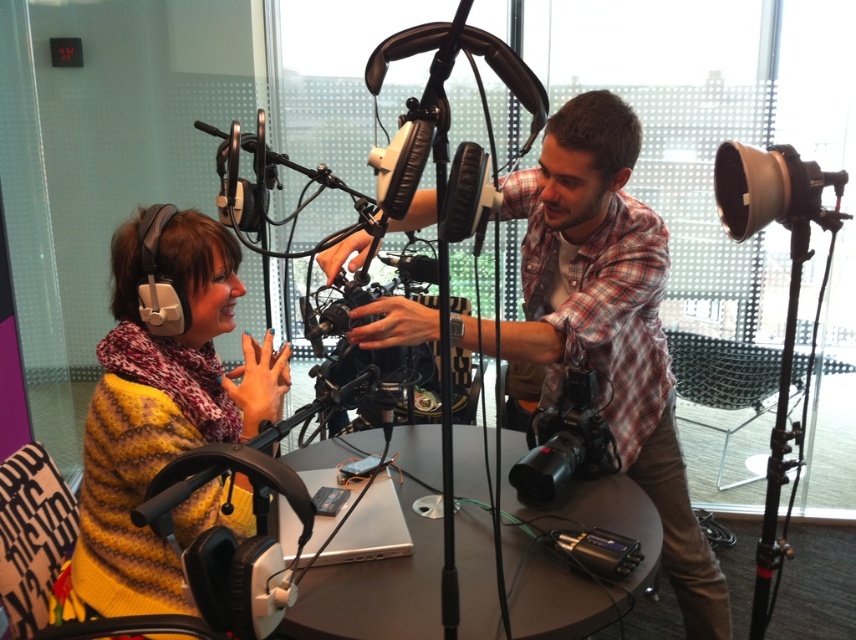
Question: Does plaid shirt at center have a smaller size compared to black plastic video camera at center?

Choices:
 (A) yes
 (B) no

Answer: (B)

Question: Is plaid shirt at center positioned before metallic silver table at center?

Choices:
 (A) no
 (B) yes

Answer: (A)

Question: Which of the following is the closest to the observer?

Choices:
 (A) (504, 586)
 (B) (462, 337)

Answer: (A)

Question: Does plaid shirt at center come in front of knitted yellow sweater at left?

Choices:
 (A) yes
 (B) no

Answer: (B)

Question: Which is nearer to the black plastic video camera at center?

Choices:
 (A) knitted yellow sweater at left
 (B) plaid shirt at center

Answer: (B)

Question: Based on their relative distances, which object is nearer to the black plastic video camera at center?

Choices:
 (A) plaid shirt at center
 (B) metallic silver table at center
 (C) knitted yellow sweater at left

Answer: (B)